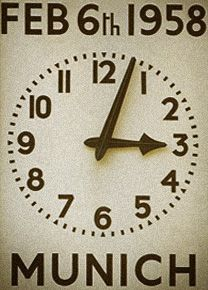
Find the location of a particular element. The image size is (208, 290). clock minute markers is located at coordinates (131, 229), (41, 209), (19, 105).